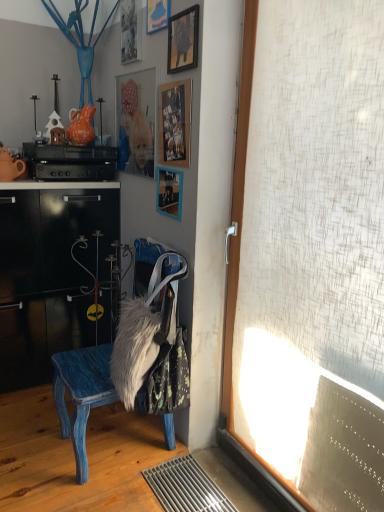
Question: Can you confirm if blonde hair doll at upper center is thinner than blue painted wood chair at center?

Choices:
 (A) no
 (B) yes

Answer: (B)

Question: From a real-world perspective, is blonde hair doll at upper center over blue painted wood chair at center?

Choices:
 (A) no
 (B) yes

Answer: (B)

Question: Would you say blonde hair doll at upper center is a long distance from blue painted wood chair at center?

Choices:
 (A) no
 (B) yes

Answer: (B)

Question: Does blonde hair doll at upper center have a lesser height compared to blue painted wood chair at center?

Choices:
 (A) yes
 (B) no

Answer: (A)

Question: Does blonde hair doll at upper center have a greater width compared to blue painted wood chair at center?

Choices:
 (A) no
 (B) yes

Answer: (A)

Question: In terms of size, does matte orange teapot at left, which is the 1th teapot in left-to-right order, appear bigger or smaller than fuzzy fabric bag at lower center?

Choices:
 (A) small
 (B) big

Answer: (A)

Question: Considering the positions of matte orange teapot at left, which ranks as the 2th teapot in right-to-left order, and fuzzy fabric bag at lower center in the image, is matte orange teapot at left, which ranks as the 2th teapot in right-to-left order, taller or shorter than fuzzy fabric bag at lower center?

Choices:
 (A) short
 (B) tall

Answer: (A)

Question: From a real-world perspective, is matte orange teapot at left, which ranks as the 2th teapot in right-to-left order, positioned above or below fuzzy fabric bag at lower center?

Choices:
 (A) above
 (B) below

Answer: (A)

Question: In the image, is matte orange teapot at left, which is the 1th teapot in left-to-right order, positioned in front of or behind fuzzy fabric bag at lower center?

Choices:
 (A) behind
 (B) front

Answer: (A)

Question: From the image's perspective, is fuzzy fabric bag at lower center positioned above or below wooden picture frame at upper center, placed as the 1th picture frame when sorted from bottom to top?

Choices:
 (A) below
 (B) above

Answer: (A)

Question: Looking at their shapes, would you say fuzzy fabric bag at lower center is wider or thinner than wooden picture frame at upper center, arranged as the fifth picture frame when viewed from the top?

Choices:
 (A) thin
 (B) wide

Answer: (B)

Question: Is fuzzy fabric bag at lower center taller or shorter than wooden picture frame at upper center, placed as the 1th picture frame when sorted from bottom to top?

Choices:
 (A) short
 (B) tall

Answer: (B)

Question: Considering the positions of point (168, 340) and point (168, 194), is point (168, 340) closer or farther from the camera than point (168, 194)?

Choices:
 (A) farther
 (B) closer

Answer: (B)

Question: Does point (148, 8) appear closer or farther from the camera than point (139, 31)?

Choices:
 (A) closer
 (B) farther

Answer: (A)

Question: From the image's perspective, is matte blue picture frame at upper center, the 1th picture frame from the top, above or below metallic silver picture frame at upper center, the second picture frame when ordered from top to bottom?

Choices:
 (A) above
 (B) below

Answer: (A)